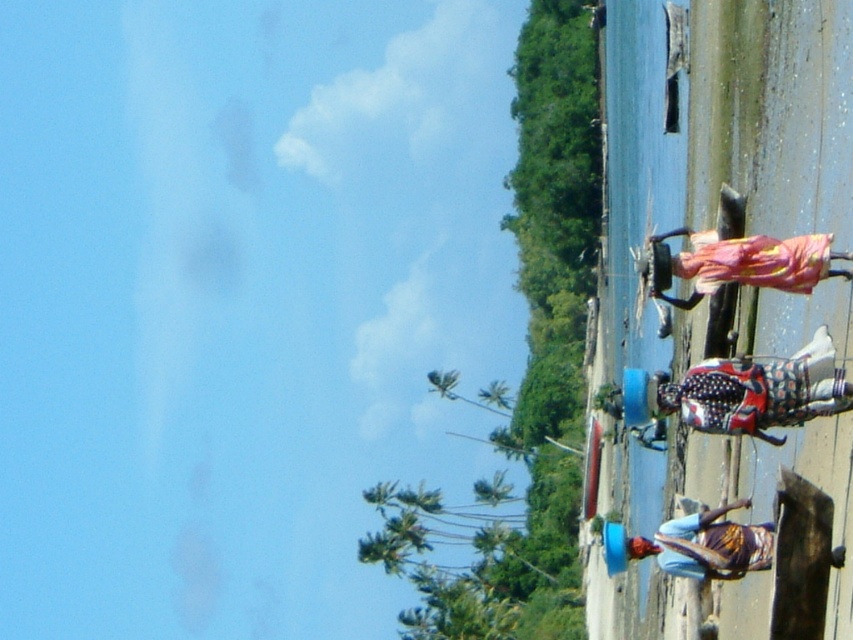
Which is more to the left, polka dot fabric at center or multicolored fabric at lower center?

multicolored fabric at lower center

Is polka dot fabric at center behind multicolored fabric at lower center?

No, it is not.

Between point (843, 404) and point (740, 502), which one is positioned behind?

Positioned behind is point (740, 502).

This screenshot has height=640, width=853. Find the location of `polka dot fabric at center`. polka dot fabric at center is located at coordinates (759, 392).